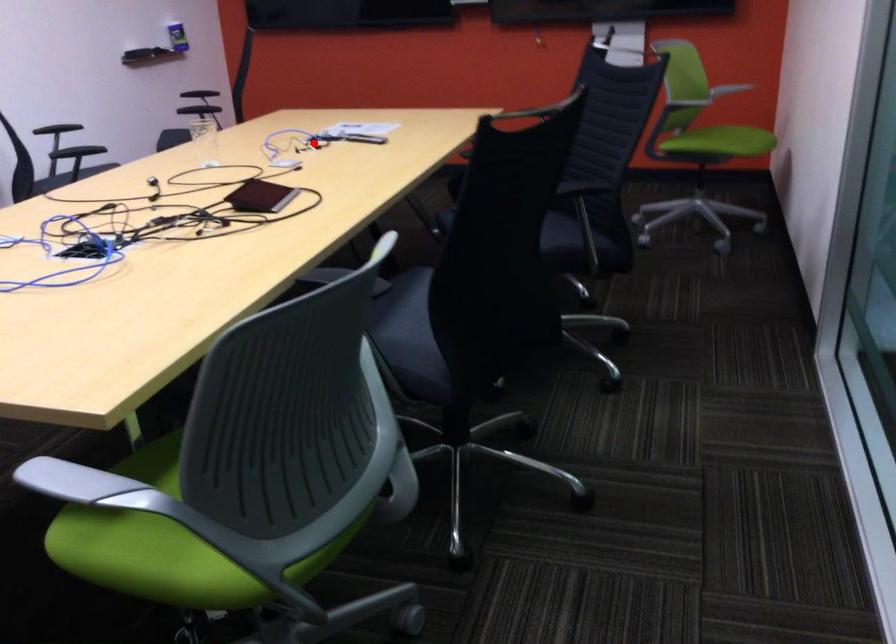
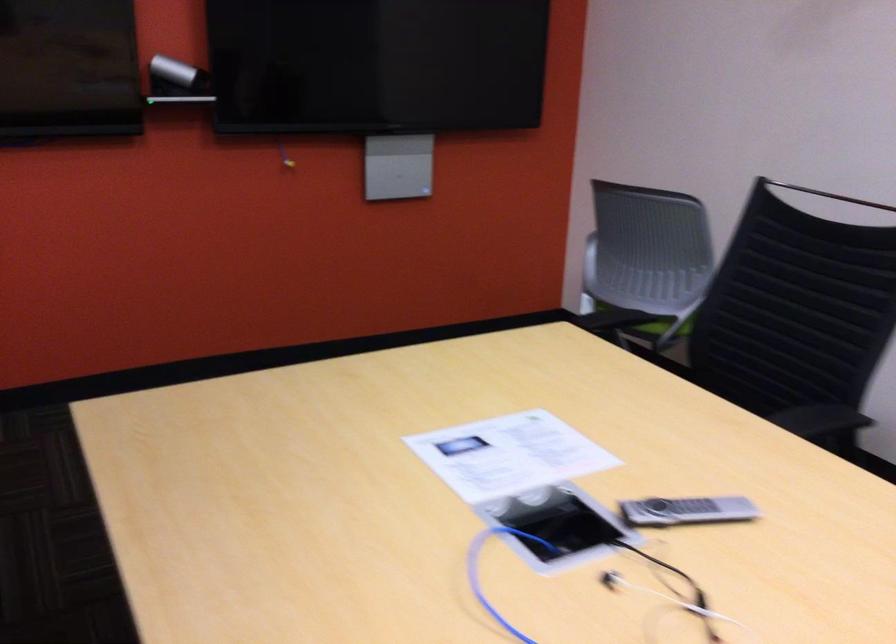
Locate, in the second image, the point that corresponds to the highlighted location in the first image.

(576, 583)